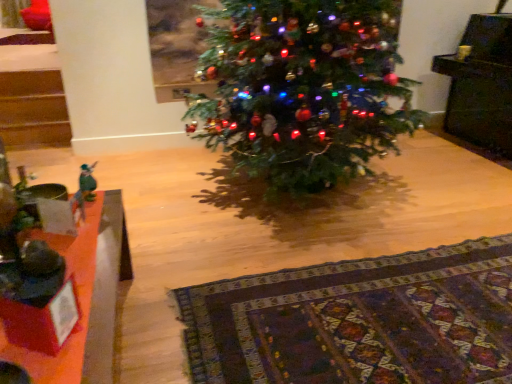
Question: Is green matte christmas tree at center spatially inside patterned wool rug at lower center, or outside of it?

Choices:
 (A) inside
 (B) outside

Answer: (B)

Question: Considering their positions, is green matte christmas tree at center located in front of or behind patterned wool rug at lower center?

Choices:
 (A) front
 (B) behind

Answer: (B)

Question: Which object is the closest to the green matte christmas tree at center?

Choices:
 (A) patterned wool rug at lower center
 (B) wooden table at lower left
 (C) green felt angel at left

Answer: (A)

Question: Which of these objects is positioned farthest from the patterned wool rug at lower center?

Choices:
 (A) wooden table at lower left
 (B) green matte christmas tree at center
 (C) green felt angel at left

Answer: (C)